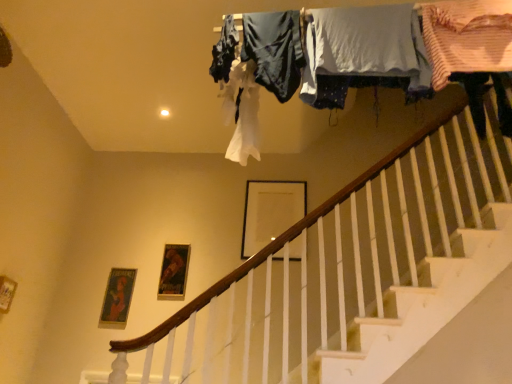
Question: Could you tell me if dark blue fabric at upper center, the first clothing in the left-to-right sequence, is facing metallic gold picture frame at center, the 2th picture frame positioned from the top?

Choices:
 (A) no
 (B) yes

Answer: (A)

Question: Can you confirm if dark blue fabric at upper center, the 4th clothing viewed from the right, is thinner than metallic gold picture frame at center, which is counted as the first picture frame, starting from the bottom?

Choices:
 (A) no
 (B) yes

Answer: (A)

Question: Can you confirm if dark blue fabric at upper center, the 4th clothing viewed from the right, is wider than metallic gold picture frame at center, the 2th picture frame positioned from the top?

Choices:
 (A) no
 (B) yes

Answer: (B)

Question: Is dark blue fabric at upper center, the 4th clothing viewed from the right, positioned with its back to metallic gold picture frame at center, the 2th picture frame positioned from the top?

Choices:
 (A) yes
 (B) no

Answer: (B)

Question: From the image's perspective, is dark blue fabric at upper center, the first clothing in the left-to-right sequence, located above metallic gold picture frame at center, the first picture frame in the left-to-right sequence?

Choices:
 (A) yes
 (B) no

Answer: (A)

Question: Considering the relative positions of dark blue fabric at upper center, the 4th clothing viewed from the right, and metallic gold picture frame at center, the 2th picture frame positioned from the top, in the image provided, is dark blue fabric at upper center, the 4th clothing viewed from the right, to the right of metallic gold picture frame at center, the 2th picture frame positioned from the top, from the viewer's perspective?

Choices:
 (A) yes
 (B) no

Answer: (A)

Question: Is silky blue fabric at upper center, arranged as the third clothing when viewed from the right, beside white cotton shirt at upper center, which appears as the third clothing when viewed from the left?

Choices:
 (A) yes
 (B) no

Answer: (B)

Question: From a real-world perspective, is silky blue fabric at upper center, the second clothing in the left-to-right sequence, positioned over white cotton shirt at upper center, the 2th clothing viewed from the right, based on gravity?

Choices:
 (A) no
 (B) yes

Answer: (A)

Question: Considering the relative sizes of silky blue fabric at upper center, arranged as the third clothing when viewed from the right, and white cotton shirt at upper center, which appears as the third clothing when viewed from the left, in the image provided, is silky blue fabric at upper center, arranged as the third clothing when viewed from the right, thinner than white cotton shirt at upper center, which appears as the third clothing when viewed from the left,?

Choices:
 (A) no
 (B) yes

Answer: (B)

Question: Could you tell me if silky blue fabric at upper center, the second clothing in the left-to-right sequence, is turned towards white cotton shirt at upper center, which appears as the third clothing when viewed from the left?

Choices:
 (A) yes
 (B) no

Answer: (B)

Question: From a real-world perspective, is silky blue fabric at upper center, arranged as the third clothing when viewed from the right, beneath white cotton shirt at upper center, the 2th clothing viewed from the right?

Choices:
 (A) no
 (B) yes

Answer: (B)

Question: Is silky blue fabric at upper center, the second clothing in the left-to-right sequence, shorter than white cotton shirt at upper center, the 2th clothing viewed from the right?

Choices:
 (A) yes
 (B) no

Answer: (A)

Question: Can you confirm if white cotton shirt at upper center, which appears as the third clothing when viewed from the left, is bigger than dark blue fabric at upper center, the 4th clothing viewed from the right?

Choices:
 (A) no
 (B) yes

Answer: (B)